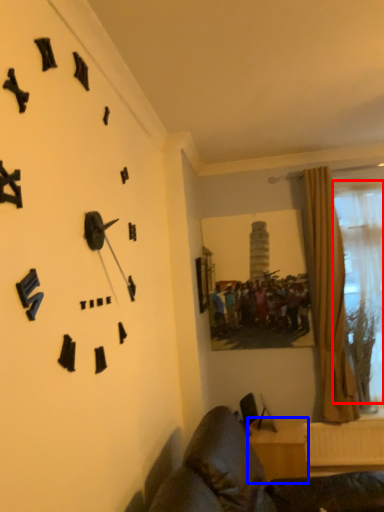
Question: Among these objects, which one is farthest to the camera, bay window (highlighted by a red box) or furniture (highlighted by a blue box)?

Choices:
 (A) bay window
 (B) furniture

Answer: (A)